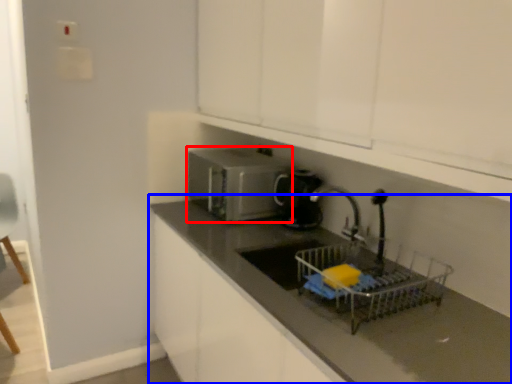
Question: Which point is closer to the camera, home appliance (highlighted by a red box) or countertop (highlighted by a blue box)?

Choices:
 (A) home appliance
 (B) countertop

Answer: (B)